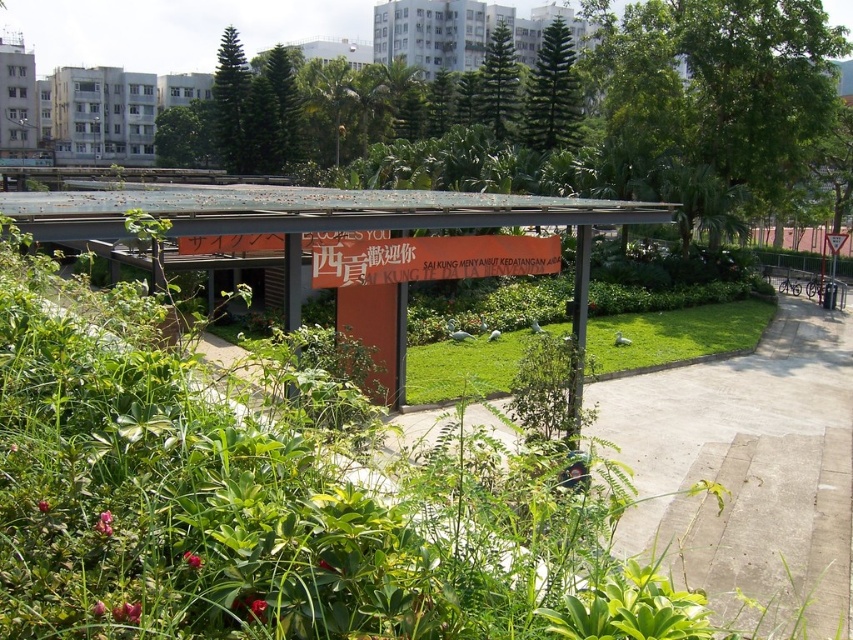
Is metallic orange signboard at center to the right of green grass at center from the viewer's perspective?

No, metallic orange signboard at center is not to the right of green grass at center.

Image resolution: width=853 pixels, height=640 pixels. What do you see at coordinates (302, 212) in the screenshot?
I see `metallic orange signboard at center` at bounding box center [302, 212].

The image size is (853, 640). What are the coordinates of `metallic orange signboard at center` in the screenshot? It's located at (302, 212).